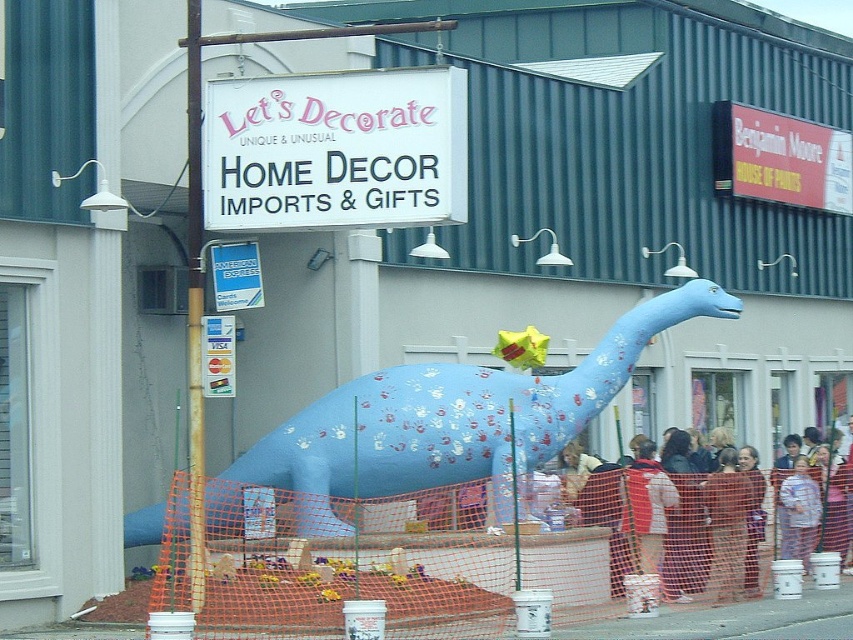
You are a window shopper walking past the storefront. You notice the white plastic sign at upper center and the light brown fabric jacket at lower right. Which object is larger in size?

The white plastic sign at upper center is bigger than the light brown fabric jacket at lower right.

You are a customer standing in front of the storefront and want to read both the red plastic sign at upper right and the blue plastic sign at upper center. Which sign do you need to look up higher to see?

The red plastic sign at upper right is positioned over the blue plastic sign at upper center, so you need to look up higher to see the red plastic sign at upper right.

You are standing at the entrance of the Let Decorate store and want to hang a new sign that is 1.5 meters wide between the red plastic sign at upper right and the blue plastic sign at upper center. Can the new sign fit between them?

The distance between the red plastic sign at upper right and the blue plastic sign at upper center is 13.94 meters, which is more than enough to accommodate the new sign that is 1.5 meters wide.